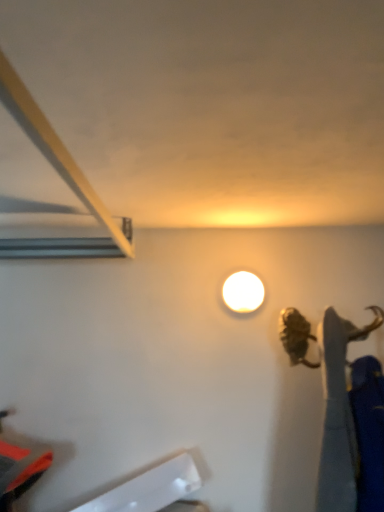
Question: From a real-world perspective, is white plastic ruler at lower left on top of white glossy lamp at upper center?

Choices:
 (A) yes
 (B) no

Answer: (B)

Question: Is white plastic ruler at lower left oriented towards white glossy lamp at upper center?

Choices:
 (A) no
 (B) yes

Answer: (A)

Question: Does white plastic ruler at lower left have a greater width compared to white glossy lamp at upper center?

Choices:
 (A) yes
 (B) no

Answer: (A)

Question: Considering the relative sizes of white plastic ruler at lower left and white glossy lamp at upper center in the image provided, is white plastic ruler at lower left bigger than white glossy lamp at upper center?

Choices:
 (A) yes
 (B) no

Answer: (A)

Question: Does white plastic ruler at lower left lie in front of white glossy lamp at upper center?

Choices:
 (A) yes
 (B) no

Answer: (A)

Question: From the image's perspective, is white plastic ruler at lower left beneath white glossy lamp at upper center?

Choices:
 (A) no
 (B) yes

Answer: (B)

Question: From a real-world perspective, is white glossy lamp at upper center over white plastic ruler at lower left?

Choices:
 (A) yes
 (B) no

Answer: (A)

Question: Is white glossy lamp at upper center positioned behind white plastic ruler at lower left?

Choices:
 (A) no
 (B) yes

Answer: (B)

Question: Would you say white glossy lamp at upper center is outside white plastic ruler at lower left?

Choices:
 (A) no
 (B) yes

Answer: (B)

Question: Is white glossy lamp at upper center placed right next to white plastic ruler at lower left?

Choices:
 (A) yes
 (B) no

Answer: (B)

Question: Would you say white plastic ruler at lower left is part of white glossy lamp at upper center's contents?

Choices:
 (A) yes
 (B) no

Answer: (B)

Question: From the image's perspective, does white glossy lamp at upper center appear higher than white plastic ruler at lower left?

Choices:
 (A) no
 (B) yes

Answer: (B)

Question: Is white plastic ruler at lower left in front of or behind white glossy lamp at upper center in the image?

Choices:
 (A) behind
 (B) front

Answer: (B)